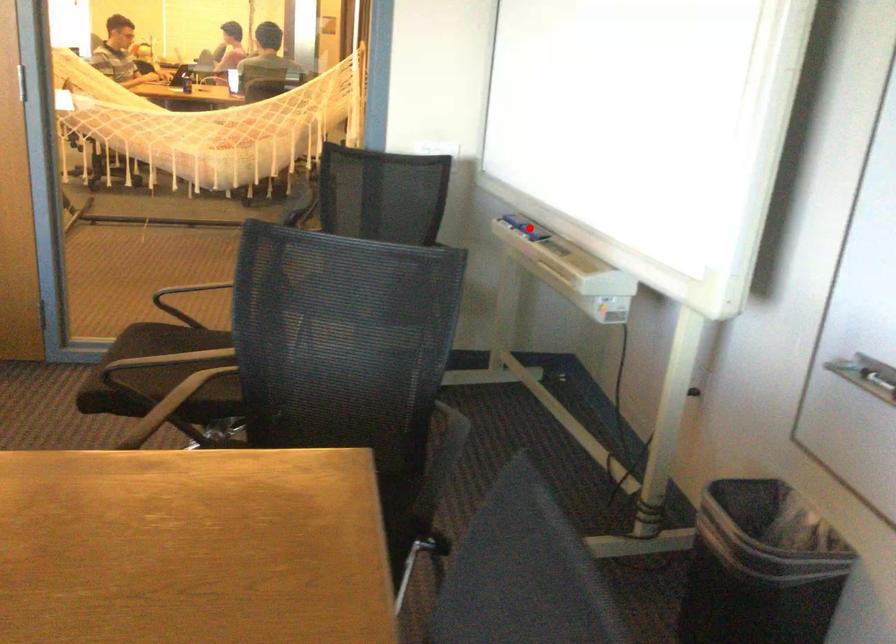
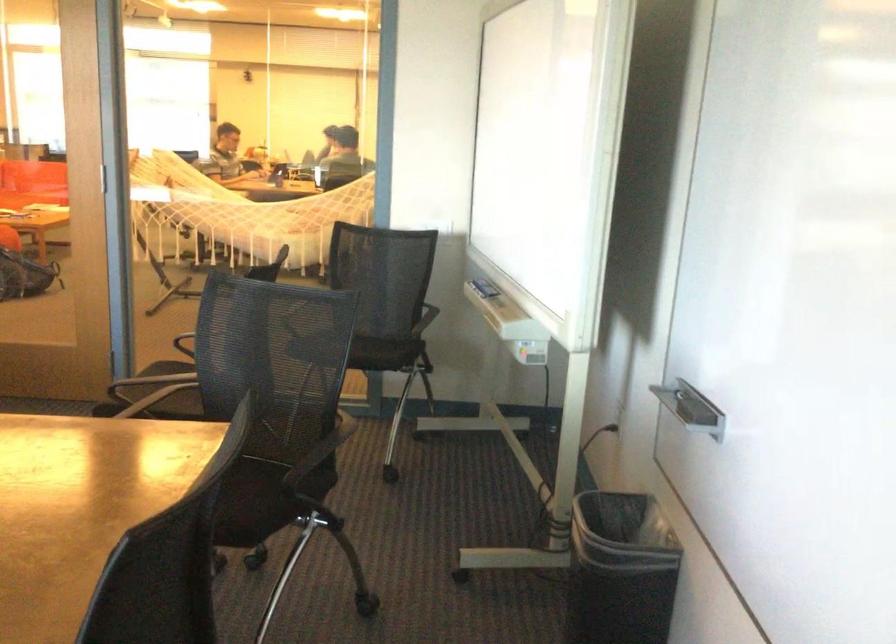
Where in the second image is the point corresponding to the highlighted location from the first image?

(484, 288)